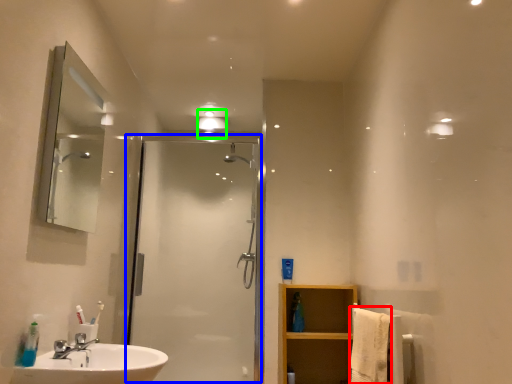
Question: Based on their relative distances, which object is nearer to bath towel (highlighted by a red box)? Choose from screen door (highlighted by a blue box) and light fixture (highlighted by a green box).

Choices:
 (A) screen door
 (B) light fixture

Answer: (A)